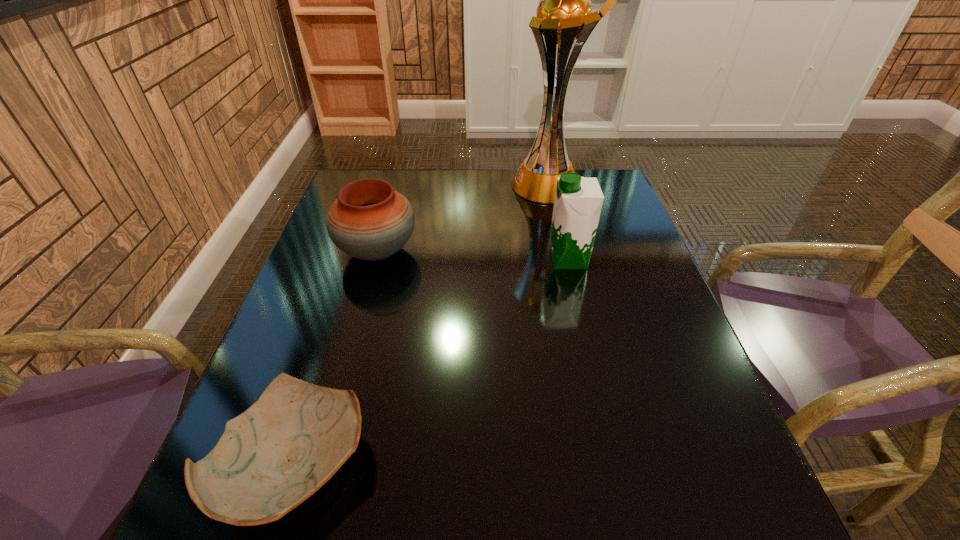
At what (x,y) coordinates should I click in order to perform the action: click on vacant space at the far left corner of the desktop. Please return your answer as a coordinate pair (x, y). Image resolution: width=960 pixels, height=540 pixels. Looking at the image, I should click on (386, 172).

At what (x,y) coordinates should I click in order to perform the action: click on free space that is in between the farthest object and the third tallest object. Please return your answer as a coordinate pair (x, y). Looking at the image, I should click on (463, 219).

Identify the location of free space between the farthest object and the third tallest object. (463, 219).

Where is `vacant area that lies between the tallest object and the taller pottery`? The image size is (960, 540). vacant area that lies between the tallest object and the taller pottery is located at coordinates (463, 219).

At what (x,y) coordinates should I click in order to perform the action: click on free space between the second tallest object and the farther pottery. Please return your answer as a coordinate pair (x, y). Image resolution: width=960 pixels, height=540 pixels. Looking at the image, I should click on (473, 255).

The image size is (960, 540). What are the coordinates of `vacant region between the taller pottery and the third shortest object` in the screenshot? It's located at (473, 255).

At what (x,y) coordinates should I click in order to perform the action: click on object that ranks as the second closest to the third shortest object. Please return your answer as a coordinate pair (x, y). Looking at the image, I should click on (369, 220).

Locate an element on the screen. The image size is (960, 540). the second closest object to the trophy is located at coordinates (369, 220).

The image size is (960, 540). I want to click on free space that satisfies the following two spatial constraints: 1. on the front-facing side of the tallest object; 2. on the front side of the taller pottery, so click(562, 252).